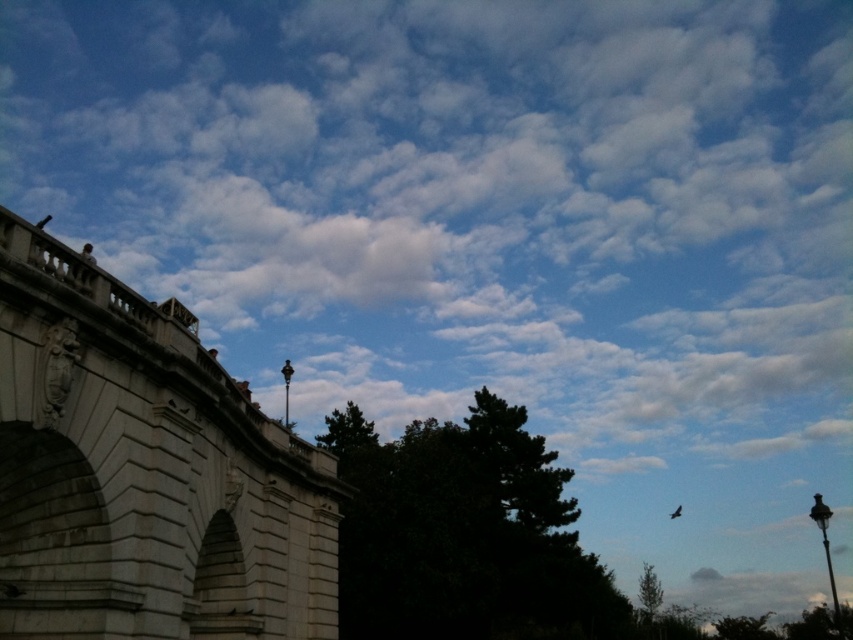
Question: Can you confirm if white fluffy cloud at upper center is thinner than brown feathered bird at upper center?

Choices:
 (A) no
 (B) yes

Answer: (A)

Question: Can you confirm if white fluffy cloud at upper center is positioned to the left of white stone bridge at left?

Choices:
 (A) yes
 (B) no

Answer: (B)

Question: Which is farther from the white stone bridge at left?

Choices:
 (A) white fluffy cloud at upper center
 (B) dark green leafy tree at center
 (C) brown feathered bird at upper center

Answer: (C)

Question: Does green leafy tree at lower right come behind black matte bird at upper center?

Choices:
 (A) yes
 (B) no

Answer: (A)

Question: Which of the following is the farthest from the observer?

Choices:
 (A) white fluffy cloud at upper center
 (B) black matte bird at upper center
 (C) green leafy tree at lower right

Answer: (A)

Question: Which of the following is the farthest from the observer?

Choices:
 (A) white stone bridge at left
 (B) white fluffy cloud at upper center
 (C) brown feathered bird at upper center

Answer: (C)